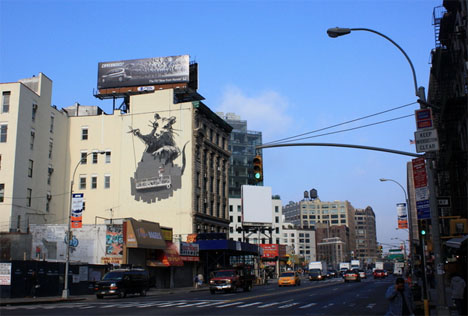
Where is `green light`? green light is located at coordinates [x=259, y=174].